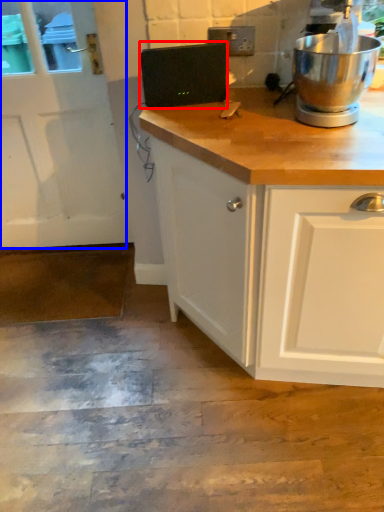
Question: Among these objects, which one is farthest to the camera, appliance (highlighted by a red box) or screen door (highlighted by a blue box)?

Choices:
 (A) appliance
 (B) screen door

Answer: (B)